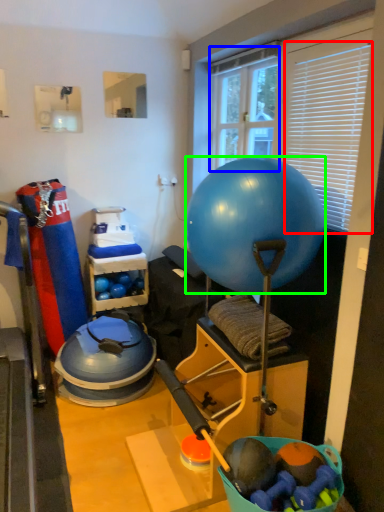
Question: Which is nearer to the blind (highlighted by a red box)? window screen (highlighted by a blue box) or ball (highlighted by a green box).

Choices:
 (A) window screen
 (B) ball

Answer: (B)